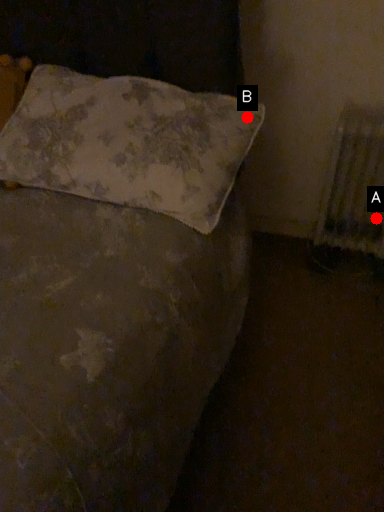
Question: Two points are circled on the image, labeled by A and B beside each circle. Which point is closer to the camera?

Choices:
 (A) A is closer
 (B) B is closer

Answer: (B)